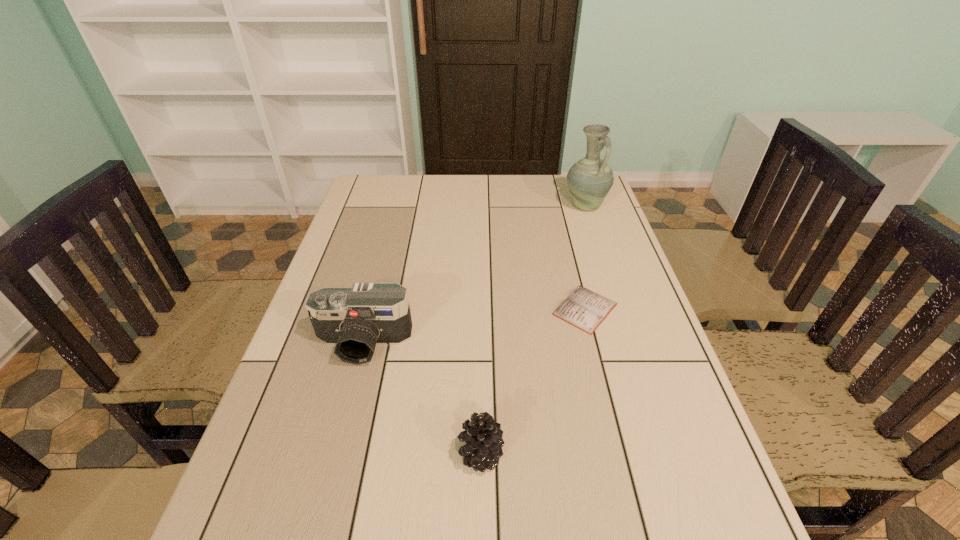
Locate an element on the screen. This screenshot has width=960, height=540. free space that is in between the diary and the tallest object is located at coordinates (586, 258).

The height and width of the screenshot is (540, 960). What are the coordinates of `vacant space that's between the shortest object and the nearest object` in the screenshot? It's located at (533, 382).

Locate an element on the screen. This screenshot has height=540, width=960. vacant space that is in between the diary and the nearest object is located at coordinates (533, 382).

I want to click on vacant area that lies between the shortest object and the pinecone, so click(x=533, y=382).

This screenshot has width=960, height=540. Identify the location of free space that is in between the shortest object and the farthest object. (586, 258).

Locate an element on the screen. blank region between the pinecone and the diary is located at coordinates (533, 382).

Find the location of a particular element. free spot between the third object from right to left and the camera is located at coordinates (422, 399).

Locate an element on the screen. The width and height of the screenshot is (960, 540). free space between the farthest object and the nearest object is located at coordinates click(533, 330).

At what (x,y) coordinates should I click in order to perform the action: click on vacant space that is in between the tallest object and the diary. Please return your answer as a coordinate pair (x, y). The width and height of the screenshot is (960, 540). Looking at the image, I should click on (586, 258).

Where is `vacant area between the shortest object and the farthest object`? vacant area between the shortest object and the farthest object is located at coordinates (586, 258).